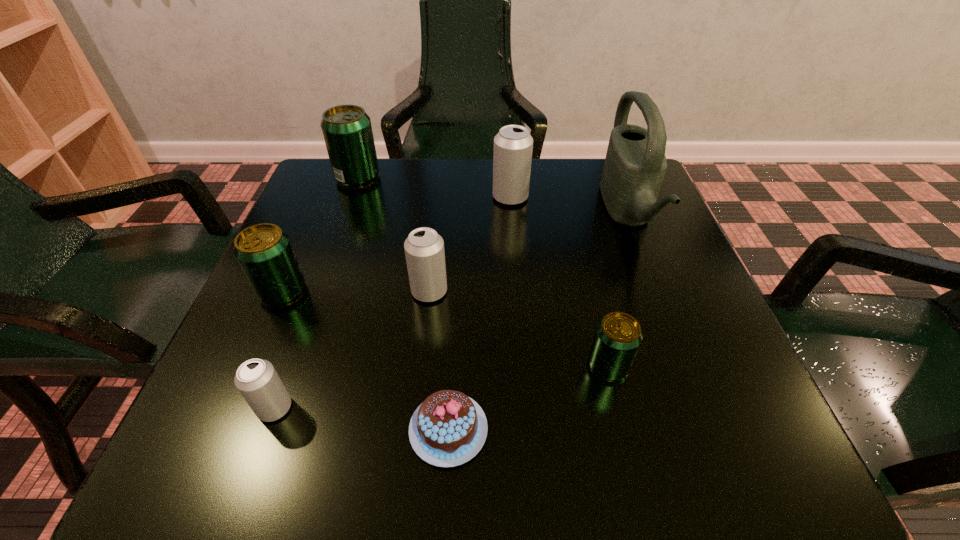
This screenshot has height=540, width=960. In order to click on beer can that stands as the fifth closest to the shortest object in this screenshot , I will do `click(513, 145)`.

Point out which green beer can is positioned as the third nearest to the smallest white beer can. Please provide its 2D coordinates. Your answer should be formatted as a tuple, i.e. [(x, y)], where the tuple contains the x and y coordinates of a point satisfying the conditions above.

[(347, 131)]

This screenshot has height=540, width=960. In order to click on green beer can object that ranks as the closest to the second nearest green beer can in this screenshot , I will do `click(347, 131)`.

Locate which white beer can ranks second in proximity to the green watering can. Please provide its 2D coordinates. Your answer should be formatted as a tuple, i.e. [(x, y)], where the tuple contains the x and y coordinates of a point satisfying the conditions above.

[(424, 249)]

Select which white beer can appears as the second closest to the second nearest beer can. Please provide its 2D coordinates. Your answer should be formatted as a tuple, i.e. [(x, y)], where the tuple contains the x and y coordinates of a point satisfying the conditions above.

[(513, 145)]

Find the location of `vacant area in the image that satisfies the following two spatial constraints: 1. on the front side of the second smallest green beer can; 2. on the left side of the rightmost green beer can`. vacant area in the image that satisfies the following two spatial constraints: 1. on the front side of the second smallest green beer can; 2. on the left side of the rightmost green beer can is located at coordinates (251, 366).

Where is `vacant area that satisfies the following two spatial constraints: 1. on the front side of the biggest green beer can; 2. on the left side of the nearest green beer can`? Image resolution: width=960 pixels, height=540 pixels. vacant area that satisfies the following two spatial constraints: 1. on the front side of the biggest green beer can; 2. on the left side of the nearest green beer can is located at coordinates (291, 366).

Locate an element on the screen. The image size is (960, 540). free space that satisfies the following two spatial constraints: 1. on the front side of the chocolate cake; 2. on the right side of the smallest white beer can is located at coordinates (267, 429).